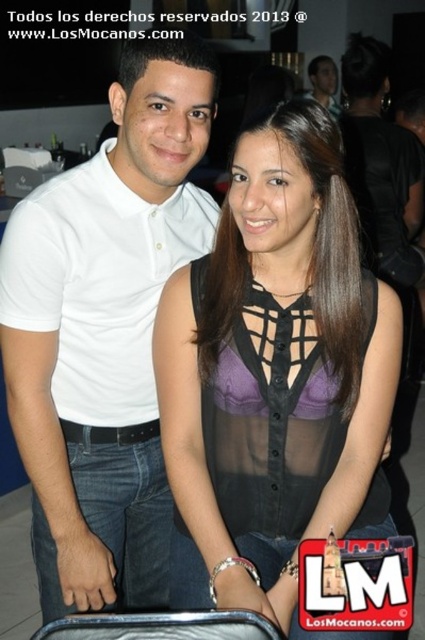
Question: Among these points, which one is nearest to the camera?

Choices:
 (A) (328, 120)
 (B) (59, 445)
 (C) (326, 84)

Answer: (A)

Question: Does white cotton polo shirt at center appear on the left side of matte black shirt at upper center?

Choices:
 (A) no
 (B) yes

Answer: (B)

Question: From the image, what is the correct spatial relationship of sheer black blouse at center in relation to white cotton polo shirt at center?

Choices:
 (A) left
 (B) right

Answer: (B)

Question: Which of the following is the farthest from the observer?

Choices:
 (A) (163, 476)
 (B) (320, 333)

Answer: (A)

Question: Does white cotton polo shirt at center have a lesser width compared to matte black shirt at upper center?

Choices:
 (A) yes
 (B) no

Answer: (B)

Question: Among these objects, which one is farthest from the camera?

Choices:
 (A) white cotton polo shirt at center
 (B) sheer black blouse at center
 (C) matte black shirt at upper center

Answer: (C)